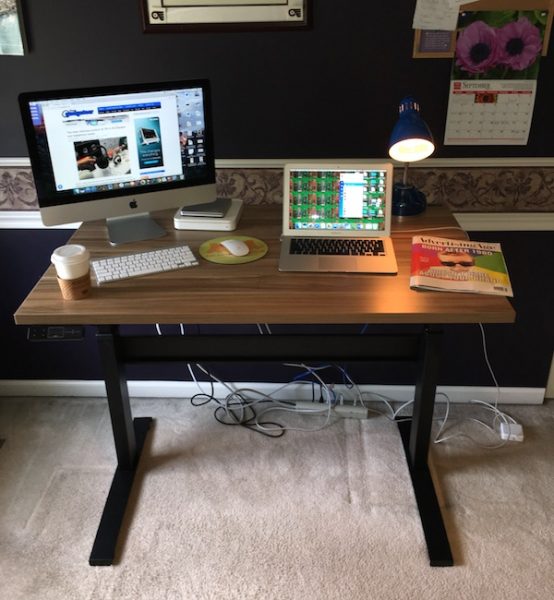
I want to click on mouse, so click(210, 236).